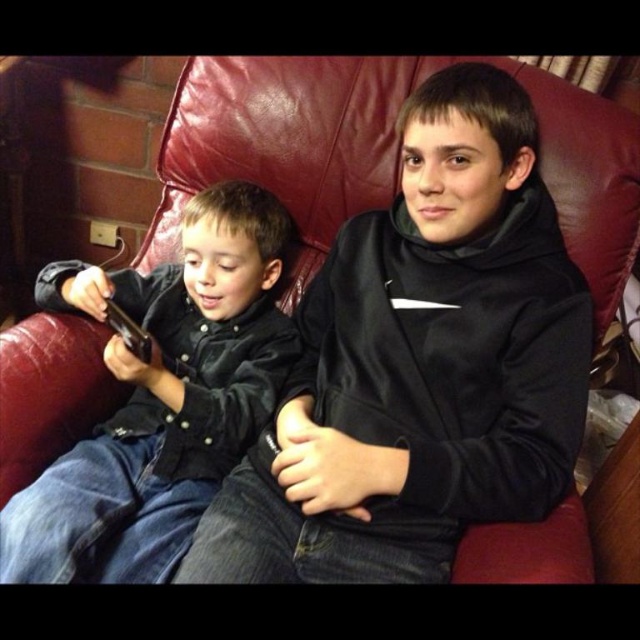
Can you confirm if black matte hoodie at center is shorter than matte black shirt at left?

Incorrect, black matte hoodie at center's height does not fall short of matte black shirt at left's.

Is black matte hoodie at center further to camera compared to matte black shirt at left?

Yes, it is behind matte black shirt at left.

Which is in front, point (492, 467) or point (214, 218)?

Point (492, 467) is more forward.

I want to click on black matte hoodie at center, so click(420, 364).